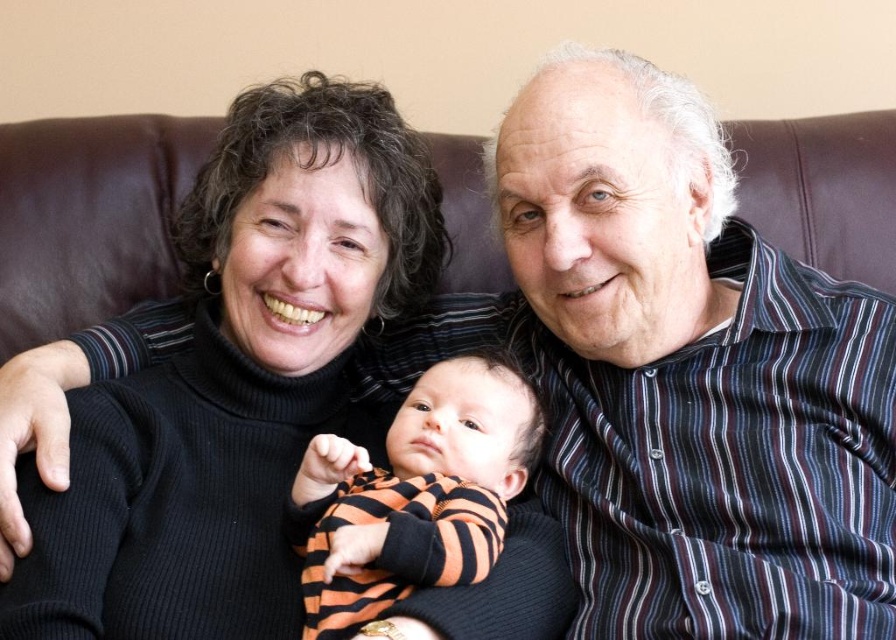
Which is behind, point (589, 449) or point (352, 182)?

Point (589, 449)

Which is more to the right, striped shirt at upper right or black turtleneck sweater at center?

Positioned to the right is striped shirt at upper right.

Who is more forward, (681,122) or (67,451)?

Point (67,451) is more forward.

Where is `striped shirt at upper right`? This screenshot has width=896, height=640. striped shirt at upper right is located at coordinates (694, 372).

Which is below, striped shirt at upper right or orange striped onesie at center?

orange striped onesie at center is lower down.

How much distance is there between striped shirt at upper right and orange striped onesie at center?

striped shirt at upper right and orange striped onesie at center are 8.46 inches apart from each other.

Between point (866, 289) and point (451, 451), which one is positioned behind?

The point (866, 289) is behind.

The width and height of the screenshot is (896, 640). In order to click on striped shirt at upper right in this screenshot , I will do `click(694, 372)`.

Is point (290, 339) positioned in front of point (448, 540)?

No, it is not.

Which is more to the left, black turtleneck sweater at center or orange striped onesie at center?

Positioned to the left is black turtleneck sweater at center.

Is point (265, 300) positioned in front of point (399, 444)?

No, (265, 300) is behind (399, 444).

Locate an element on the screen. The image size is (896, 640). black turtleneck sweater at center is located at coordinates 252,346.